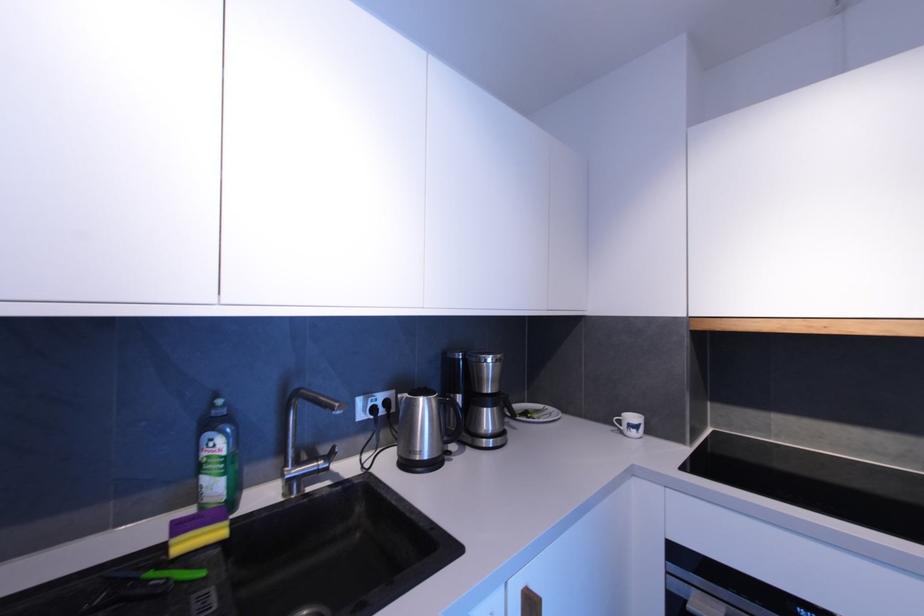
Find the location of a particular element. Image resolution: width=924 pixels, height=616 pixels. faucet handle is located at coordinates (325, 459).